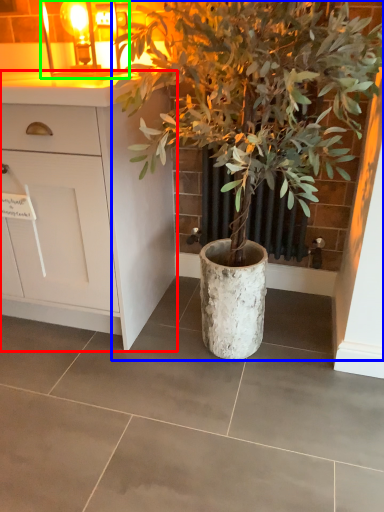
Question: Based on their relative distances, which object is nearer to cabinetry (highlighted by a red box)? Choose from houseplant (highlighted by a blue box) and light fixture (highlighted by a green box).

Choices:
 (A) houseplant
 (B) light fixture

Answer: (A)